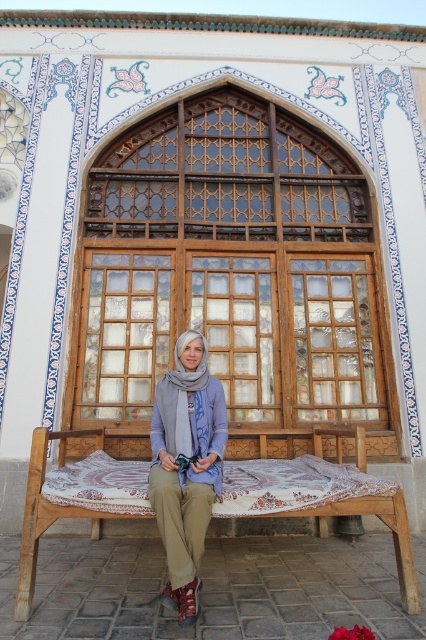
Question: Among these points, which one is farthest from the camera?

Choices:
 (A) (164, 396)
 (B) (161, 593)

Answer: (A)

Question: Does wooden bench with patterned cushion at center appear over matte gray scarf at center?

Choices:
 (A) no
 (B) yes

Answer: (A)

Question: Can you confirm if wooden bench with patterned cushion at center is positioned above matte gray scarf at center?

Choices:
 (A) no
 (B) yes

Answer: (A)

Question: Which point is farther to the camera?

Choices:
 (A) (409, 564)
 (B) (189, 424)

Answer: (B)

Question: Where is wooden bench with patterned cushion at center located in relation to matte gray scarf at center in the image?

Choices:
 (A) above
 (B) below

Answer: (B)

Question: Which object is the closest to the wooden bench with patterned cushion at center?

Choices:
 (A) gray soft scarf at center
 (B) matte gray scarf at center

Answer: (B)